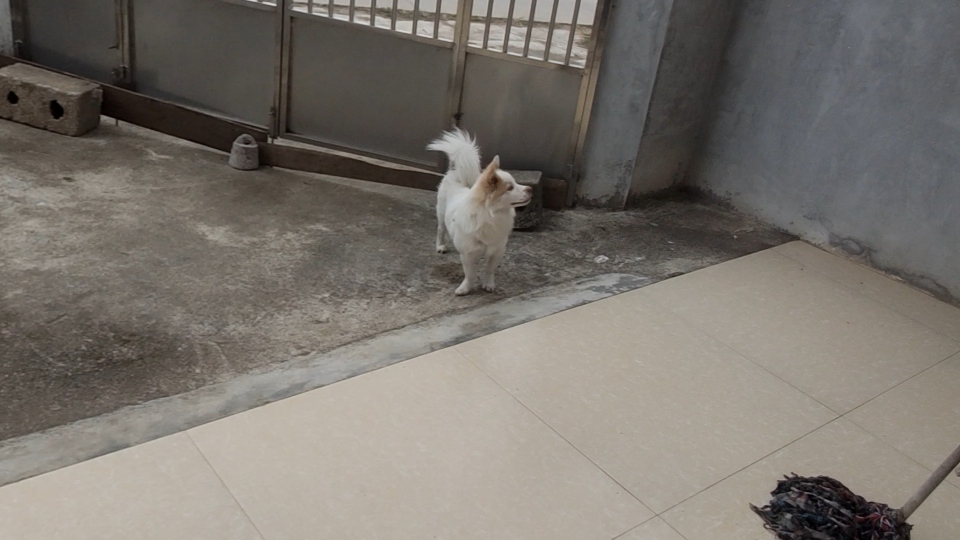
You are a GUI agent. You are given a task and a screenshot of the screen. Output one action in this format:
    pyautogui.click(x=<x>, y=<y>)
    Task: Click on the end of mop
    The height and width of the screenshot is (540, 960).
    Given the screenshot: What is the action you would take?
    pyautogui.click(x=804, y=500), pyautogui.click(x=852, y=516)